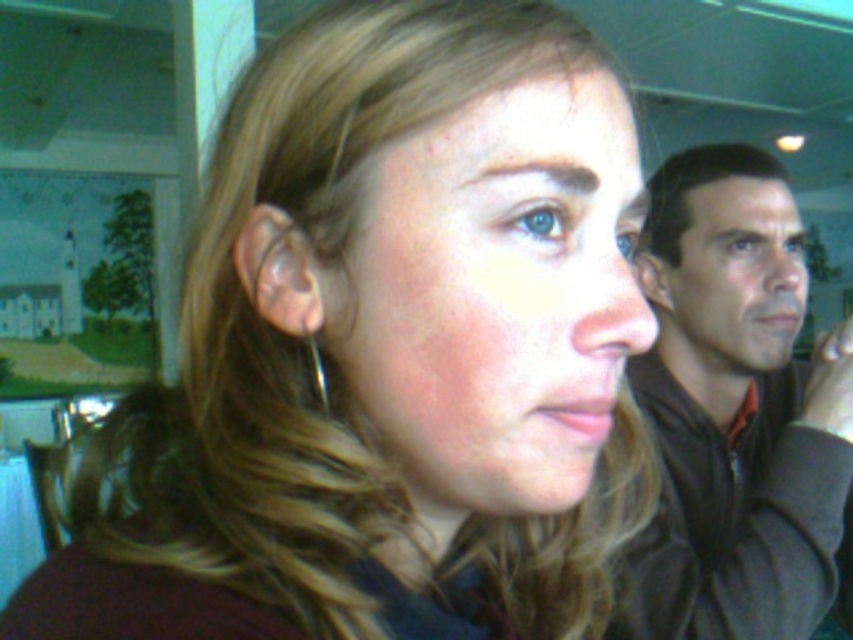
You are designing a display case for a jewelry store and need to place both the brown fabric jacket at right and the silver metallic earring at ear inside. Since the display case has a limited space, which object requires more space due to its size?

The brown fabric jacket at right requires more space because it is bigger than the silver metallic earring at ear.

You are a delivery person standing at the entrance of the cafe. You need to place a package on the brown fabric jacket at right. Can you reach it from your current position?

The brown fabric jacket at right is 30.98 inches away from the viewer, so yes, the delivery person can reach it from their current position as it is within a typical arm reach distance.

You are taking a photo of the two people in the scene. The camera is at your eye level. You want to focus on the person closer to you. Which point, point (759, 595) or point (674, 202), should you aim the camera at?

You should aim the camera at point (759, 595) because it is closer to the camera than point (674, 202), making it easier to focus on the person closer to you.